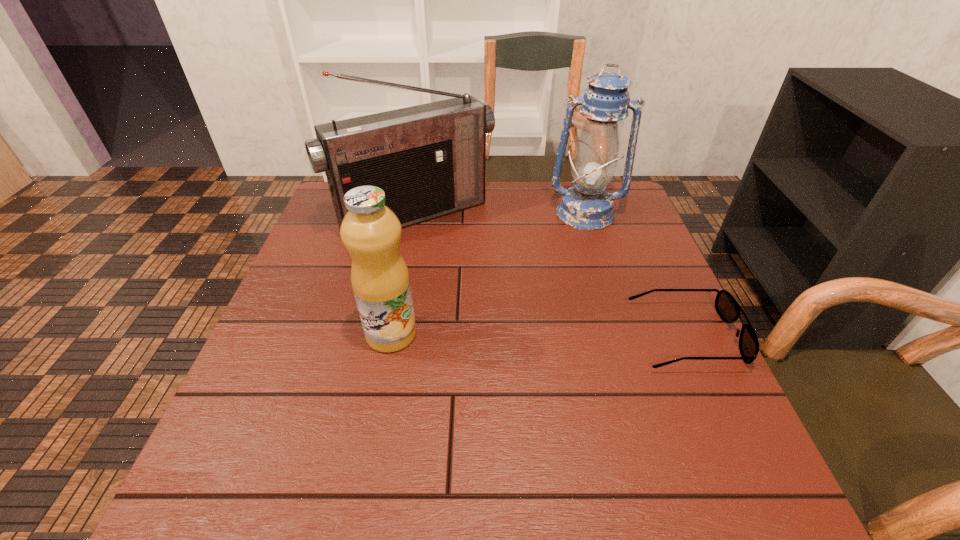
In order to click on fruit juice in this screenshot , I will do `click(371, 232)`.

Identify the location of the shortest object. This screenshot has width=960, height=540. (728, 309).

The height and width of the screenshot is (540, 960). In order to click on radio receiver in this screenshot , I will do `click(430, 160)`.

This screenshot has width=960, height=540. I want to click on lantern, so click(x=586, y=206).

In order to click on free point located on the front label of the third tallest object in this screenshot , I will do `click(449, 334)`.

Find the location of a particular element. vacant area located on the front-facing side of the radio receiver is located at coordinates (488, 288).

You are a GUI agent. You are given a task and a screenshot of the screen. Output one action in this format:
    pyautogui.click(x=<x>, y=<y>)
    Task: Click on the free space located on the front-facing side of the radio receiver
    The height and width of the screenshot is (540, 960).
    Given the screenshot: What is the action you would take?
    pyautogui.click(x=519, y=327)

Locate an element on the screen. vacant space located 0.210m on the front-facing side of the radio receiver is located at coordinates (490, 291).

Where is `free region located on the front-facing side of the lantern`? free region located on the front-facing side of the lantern is located at coordinates (582, 295).

The width and height of the screenshot is (960, 540). I want to click on free space located 0.240m on the front-facing side of the lantern, so tap(582, 289).